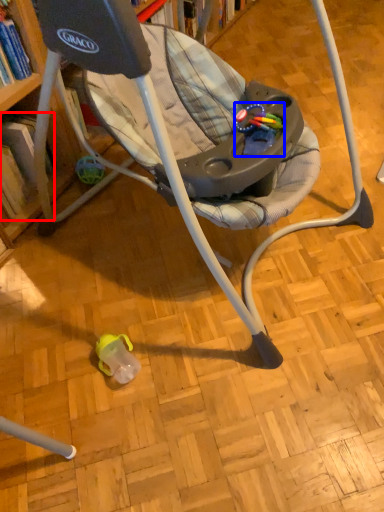
Question: Which of the following is the farthest to the observer, book (highlighted by a red box) or toy (highlighted by a blue box)?

Choices:
 (A) book
 (B) toy

Answer: (A)